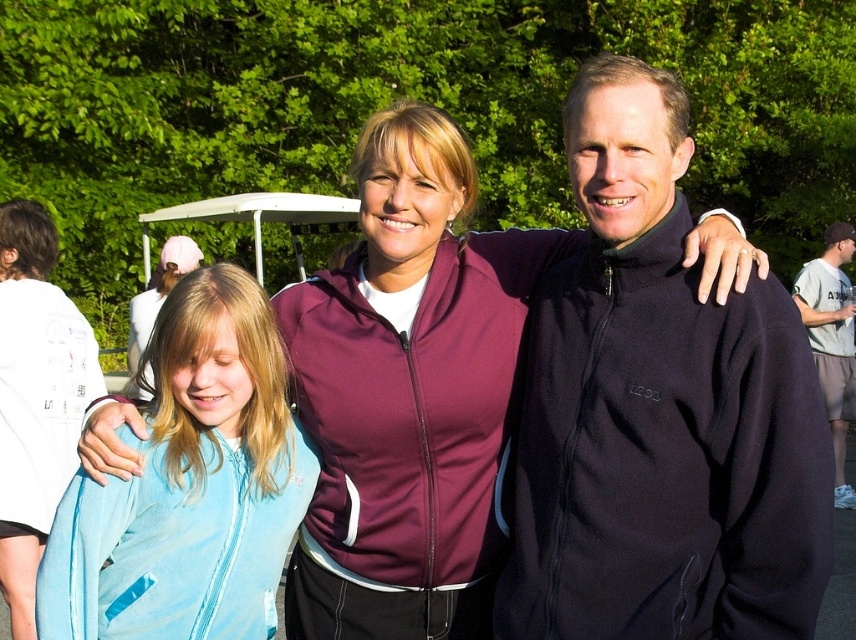
You are standing at the origin point of the image coordinate system. You see two points labeled as point (x=428, y=228) and point (x=848, y=490). Which point is closer to you?

Point (x=428, y=228) is in front of point .767, 0.992, so it is closer to you.

You are standing in the park and see the black softshell jacket at center and the light blue fleece jacket at left. Which jacket is nearer to you?

The black softshell jacket at center is closer to the viewer than the light blue fleece jacket at left.